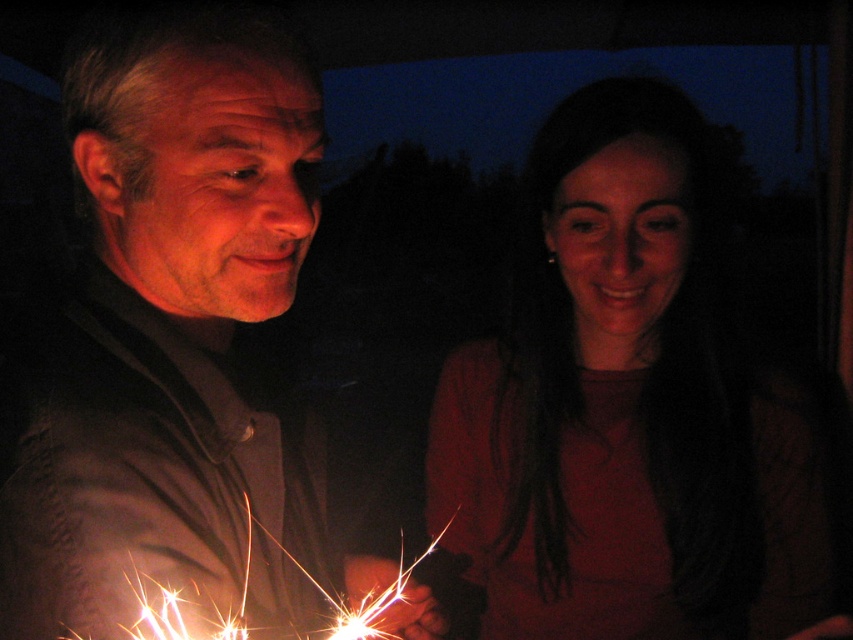
Between point (167, 220) and point (669, 548), which one is positioned behind?

Positioned behind is point (669, 548).

Who is taller, matte black shirt at left or matte red shirt at center?

matte red shirt at center

Is point (61, 346) positioned before point (469, 344)?

That is True.

Image resolution: width=853 pixels, height=640 pixels. Find the location of `matte black shirt at left`. matte black shirt at left is located at coordinates (183, 342).